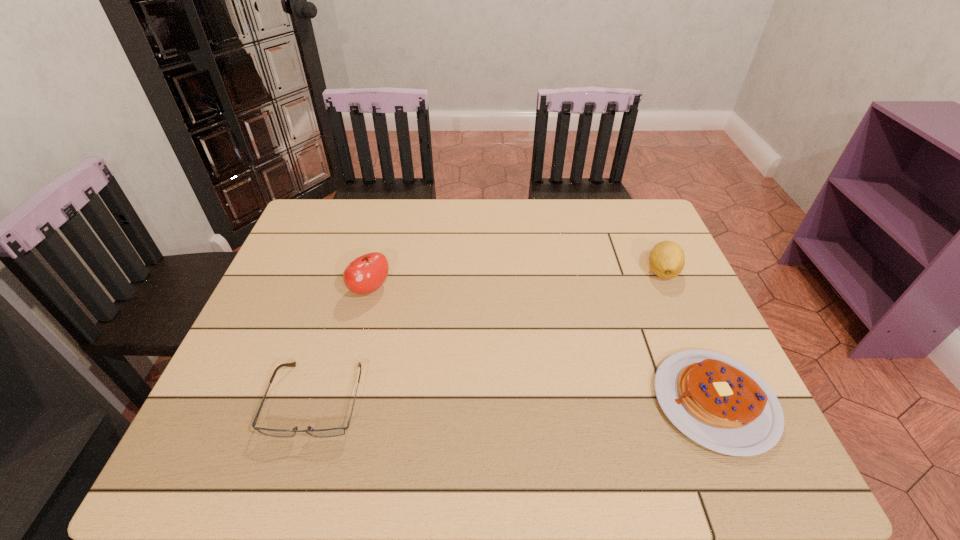
Where is `vacant region located at the stem end of the second tallest object`? Image resolution: width=960 pixels, height=540 pixels. vacant region located at the stem end of the second tallest object is located at coordinates (636, 310).

Identify the location of spectacles situated at the near edge. This screenshot has width=960, height=540. (332, 432).

Where is `pancake that is positioned at the near edge`? pancake that is positioned at the near edge is located at coordinates (718, 402).

The height and width of the screenshot is (540, 960). What are the coordinates of `object present at the left edge` in the screenshot? It's located at (332, 432).

Identify the location of pancake at the right edge. The width and height of the screenshot is (960, 540). (718, 402).

The width and height of the screenshot is (960, 540). What are the coordinates of `lemon present at the right edge` in the screenshot? It's located at (666, 259).

Where is `object located at the near left corner`? object located at the near left corner is located at coordinates (332, 432).

This screenshot has width=960, height=540. I want to click on object that is at the near right corner, so click(x=718, y=402).

In the image, there is a desktop. Where is `free region at the far edge`? The width and height of the screenshot is (960, 540). free region at the far edge is located at coordinates (580, 212).

This screenshot has width=960, height=540. Identify the location of vacant area at the near edge of the desktop. (425, 399).